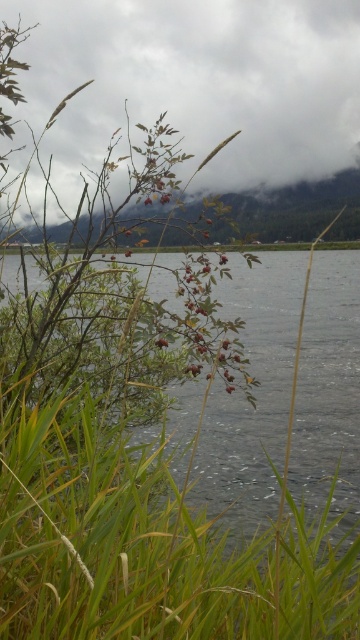
Between point (86, 60) and point (290, 317), which one is positioned in front?

Point (86, 60) is more forward.

Locate an element on the screen. This screenshot has height=640, width=360. cloudy sky at upper center is located at coordinates (196, 83).

At what (x,y) coordinates should I click in order to perform the action: click on cloudy sky at upper center. Please return your answer as a coordinate pair (x, y). The image size is (360, 640). Looking at the image, I should click on (196, 83).